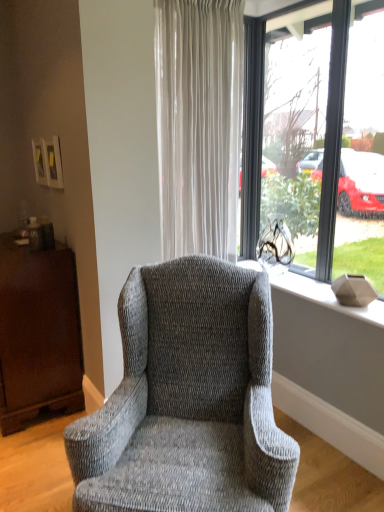
Question: Does transparent glass window at center touch matte gray vase at right?

Choices:
 (A) no
 (B) yes

Answer: (A)

Question: Is transparent glass window at center facing towards matte gray vase at right?

Choices:
 (A) yes
 (B) no

Answer: (A)

Question: From a real-world perspective, is transparent glass window at center positioned under matte gray vase at right based on gravity?

Choices:
 (A) yes
 (B) no

Answer: (B)

Question: Are transparent glass window at center and matte gray vase at right far apart?

Choices:
 (A) yes
 (B) no

Answer: (B)

Question: Can you confirm if transparent glass window at center is wider than matte gray vase at right?

Choices:
 (A) no
 (B) yes

Answer: (A)

Question: Can you confirm if transparent glass window at center is bigger than matte gray vase at right?

Choices:
 (A) no
 (B) yes

Answer: (B)

Question: Is matte gray vase at right positioned in front of mahogany wood dresser at left?

Choices:
 (A) yes
 (B) no

Answer: (A)

Question: Considering the relative sizes of matte gray vase at right and mahogany wood dresser at left in the image provided, is matte gray vase at right shorter than mahogany wood dresser at left?

Choices:
 (A) no
 (B) yes

Answer: (B)

Question: Is matte gray vase at right not inside mahogany wood dresser at left?

Choices:
 (A) no
 (B) yes

Answer: (B)

Question: Can you confirm if matte gray vase at right is wider than mahogany wood dresser at left?

Choices:
 (A) no
 (B) yes

Answer: (A)

Question: Could you tell me if matte gray vase at right is facing mahogany wood dresser at left?

Choices:
 (A) no
 (B) yes

Answer: (A)

Question: Is matte gray vase at right with mahogany wood dresser at left?

Choices:
 (A) no
 (B) yes

Answer: (A)

Question: From a real-world perspective, is mahogany wood dresser at left located beneath matte gray vase at right?

Choices:
 (A) yes
 (B) no

Answer: (A)